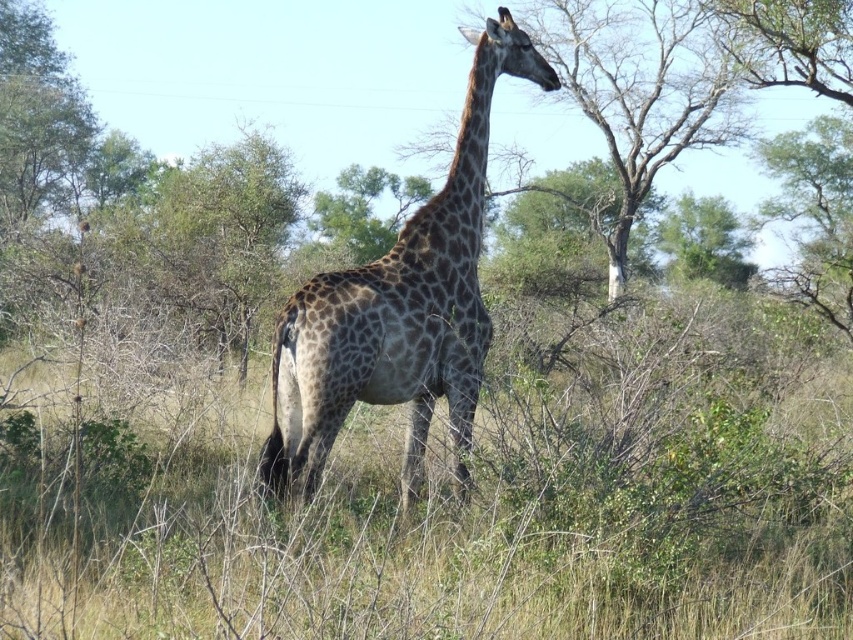
Is spotted fur giraffe at center above brown textured tree at upper center?

Incorrect, spotted fur giraffe at center is not positioned above brown textured tree at upper center.

Between spotted fur giraffe at center and brown textured tree at upper center, which one appears on the left side from the viewer's perspective?

spotted fur giraffe at center

Does point (357, 378) come closer to viewer compared to point (572, 19)?

That is True.

Find the location of `spotted fur giraffe at center`. spotted fur giraffe at center is located at coordinates (399, 307).